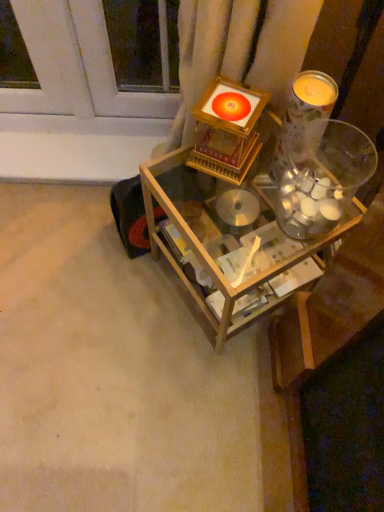
Question: Does clear glass jar at upper right have a greater width compared to wooden table at center?

Choices:
 (A) no
 (B) yes

Answer: (A)

Question: Is clear glass jar at upper right taller than wooden table at center?

Choices:
 (A) yes
 (B) no

Answer: (B)

Question: Does clear glass jar at upper right have a larger size compared to wooden table at center?

Choices:
 (A) yes
 (B) no

Answer: (B)

Question: Is wooden table at center inside clear glass jar at upper right?

Choices:
 (A) no
 (B) yes

Answer: (A)

Question: Is clear glass jar at upper right further to camera compared to wooden table at center?

Choices:
 (A) no
 (B) yes

Answer: (A)

Question: Considering the relative sizes of clear glass jar at upper right and wooden table at center in the image provided, is clear glass jar at upper right smaller than wooden table at center?

Choices:
 (A) no
 (B) yes

Answer: (B)

Question: Is there a large distance between translucent glass candle at upper right and wooden table at center?

Choices:
 (A) yes
 (B) no

Answer: (B)

Question: Is the position of translucent glass candle at upper right less distant than that of wooden table at center?

Choices:
 (A) yes
 (B) no

Answer: (A)

Question: From a real-world perspective, is translucent glass candle at upper right positioned over wooden table at center based on gravity?

Choices:
 (A) yes
 (B) no

Answer: (A)

Question: From a real-world perspective, is translucent glass candle at upper right under wooden table at center?

Choices:
 (A) no
 (B) yes

Answer: (A)

Question: Is the depth of translucent glass candle at upper right greater than that of wooden table at center?

Choices:
 (A) no
 (B) yes

Answer: (A)

Question: Considering the relative positions of translucent glass candle at upper right and wooden table at center in the image provided, is translucent glass candle at upper right to the right of wooden table at center from the viewer's perspective?

Choices:
 (A) yes
 (B) no

Answer: (A)

Question: Could you tell me if translucent glass candle at upper right is turned towards clear glass jar at upper right?

Choices:
 (A) no
 (B) yes

Answer: (B)